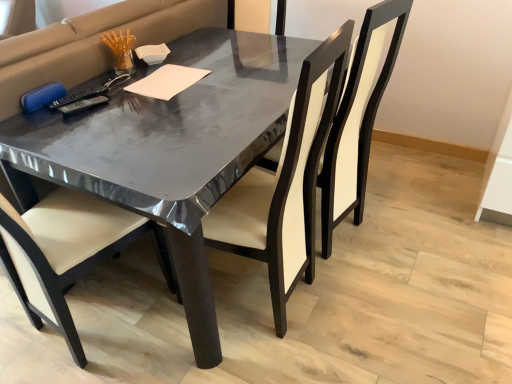
Locate an element on the screen. Image resolution: width=512 pixels, height=384 pixels. spots to the right of matte black chair at center, which ranks as the second chair in left-to-right order is located at coordinates (409, 226).